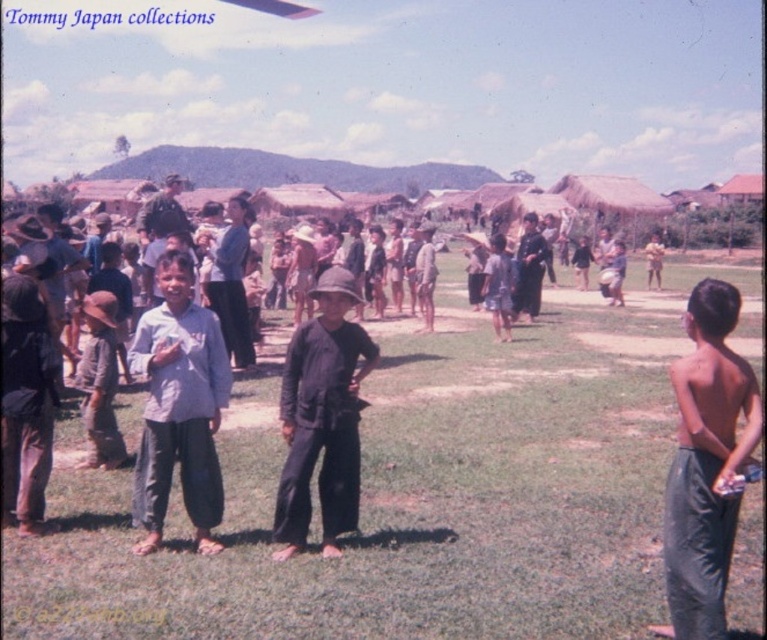
You are a photographer trying to capture a photo of the shiny gray pants at right and the brown straw hat at center. Which object should you focus on first if you want to ensure both are in focus without adjusting your camera settings?

You should focus on the shiny gray pants at right first because it is smaller than the brown straw hat at center, so focusing on the smaller object first increases the chance of both being in focus.

You are a photographer trying to capture a photo of the brown straw hat at center without the shiny gray pants at right appearing in the frame. Is it possible to adjust your position to achieve this?

The shiny gray pants at right is in front of the brown straw hat at center, so you cannot avoid capturing the shiny gray pants at right in the frame when photographing the brown straw hat at center from the current viewpoint.

You are a photographer trying to capture a photo of the two boys in the center. You need to ensure the green grass at center and the dark brown leather jacket at center are both in focus. Which object should you focus on first to ensure both are sharp?

The dark brown leather jacket at center is closer to the camera than the green grass at center. Focus on the dark brown leather jacket at center first, then adjust for the green grass at center to ensure both are in focus.